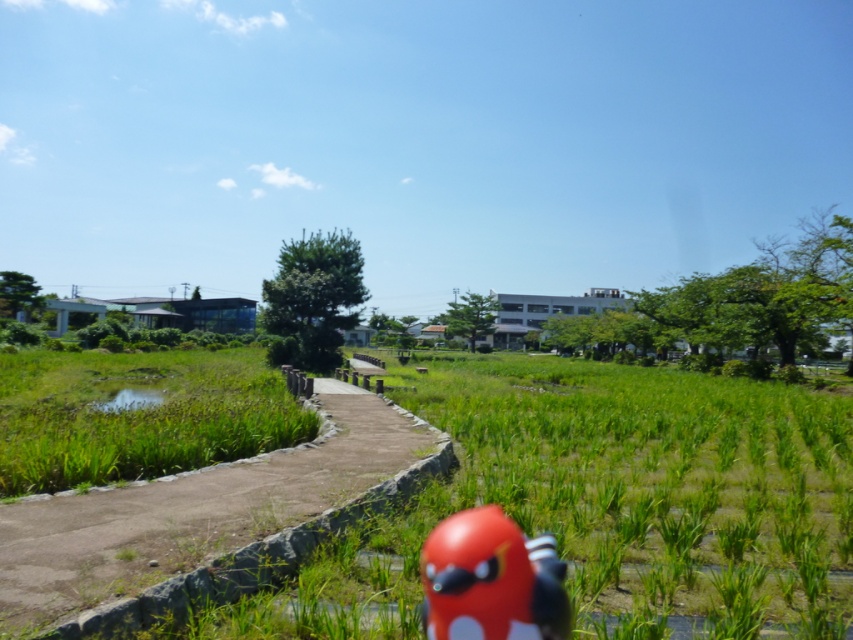
You are a child who wants to play with the shiny red toy at center. The smooth concrete path at center is in your way. Can you walk around it?

The smooth concrete path at center has a larger size compared to shiny red toy at center, so you can walk around the smooth concrete path at center to reach the shiny red toy at center.

You are a child playing in the field and see the smooth concrete path at center and the shiny red toy at center. Which object is located to the right side?

The shiny red toy at center is located to the right of the smooth concrete path at center.